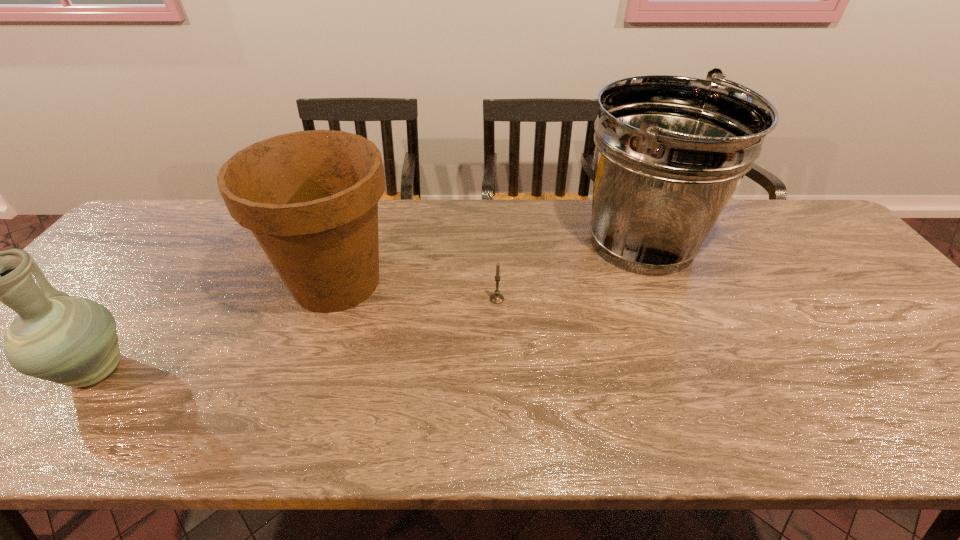
Image resolution: width=960 pixels, height=540 pixels. Find the location of `free space between the pitcher and the shortest object`. free space between the pitcher and the shortest object is located at coordinates (297, 335).

Find the location of `vacant area that lies between the flowerpot and the tallest object`. vacant area that lies between the flowerpot and the tallest object is located at coordinates (490, 262).

This screenshot has height=540, width=960. I want to click on object that is the third nearest to the tallest object, so click(72, 341).

Locate which object ranks in proximity to the candle. Please provide its 2D coordinates. Your answer should be formatted as a tuple, i.e. [(x, y)], where the tuple contains the x and y coordinates of a point satisfying the conditions above.

[(670, 151)]

The image size is (960, 540). What are the coordinates of `vacant region that satisfies the following two spatial constraints: 1. on the front side of the shortest object; 2. on the left side of the flowerpot` in the screenshot? It's located at (331, 299).

The width and height of the screenshot is (960, 540). Identify the location of free space in the image that satisfies the following two spatial constraints: 1. on the handle side of the tallest object; 2. on the left side of the leftmost object. (194, 242).

Locate an element on the screen. This screenshot has width=960, height=540. free space that satisfies the following two spatial constraints: 1. on the handle side of the leftmost object; 2. on the left side of the second object from left to right is located at coordinates (164, 282).

Identify the location of blank space that satisfies the following two spatial constraints: 1. on the handle side of the flowerpot; 2. on the right side of the nearest object. This screenshot has height=540, width=960. click(x=164, y=282).

Where is `free spot that satisfies the following two spatial constraints: 1. on the front side of the candle; 2. on the left side of the second object from left to right`? free spot that satisfies the following two spatial constraints: 1. on the front side of the candle; 2. on the left side of the second object from left to right is located at coordinates (331, 299).

Where is `free space that satisfies the following two spatial constraints: 1. on the handle side of the flowerpot; 2. on the right side of the leftmost object`? Image resolution: width=960 pixels, height=540 pixels. free space that satisfies the following two spatial constraints: 1. on the handle side of the flowerpot; 2. on the right side of the leftmost object is located at coordinates (164, 282).